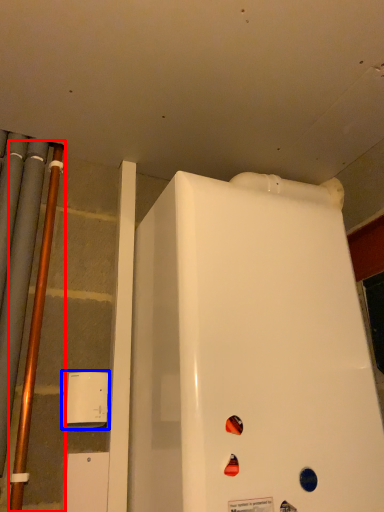
Question: Which point is closer to the camera, pipe (highlighted by a red box) or appliance (highlighted by a blue box)?

Choices:
 (A) pipe
 (B) appliance

Answer: (A)